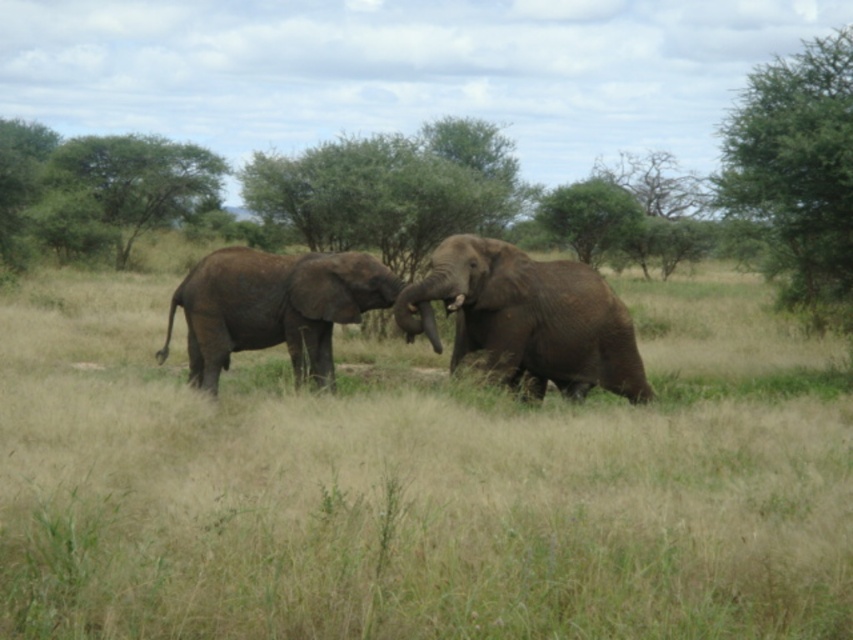
You are standing at the center of the savanna scene and want to locate the green leafy tree at upper left. Based on the coordinates provided, in which direction should you look to find it?

The green leafy tree at upper left is located at coordinates point (138,180), so you should look towards the upper left direction to find it.

You are a wildlife photographer aiming to capture a closeup shot of the gray textured elephant at center. You have a camera with a 10 meter zoom range. Can you get a clear closeup without moving closer?

The gray textured elephant at center is 11.12 meters away. Since your camera only has a 10 meter zoom range, you cannot capture a clear closeup without moving closer.